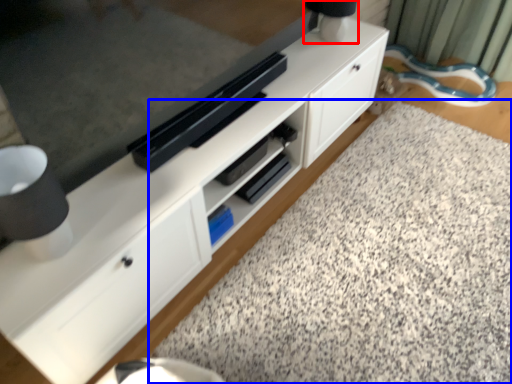
Question: Which object is closer to the camera taking this photo, table lamp (highlighted by a red box) or granite (highlighted by a blue box)?

Choices:
 (A) table lamp
 (B) granite

Answer: (B)